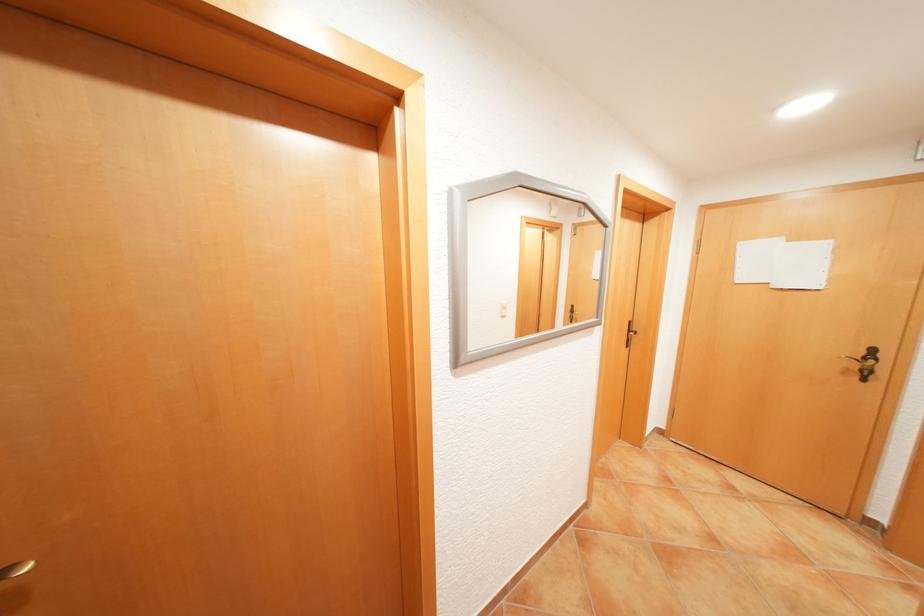
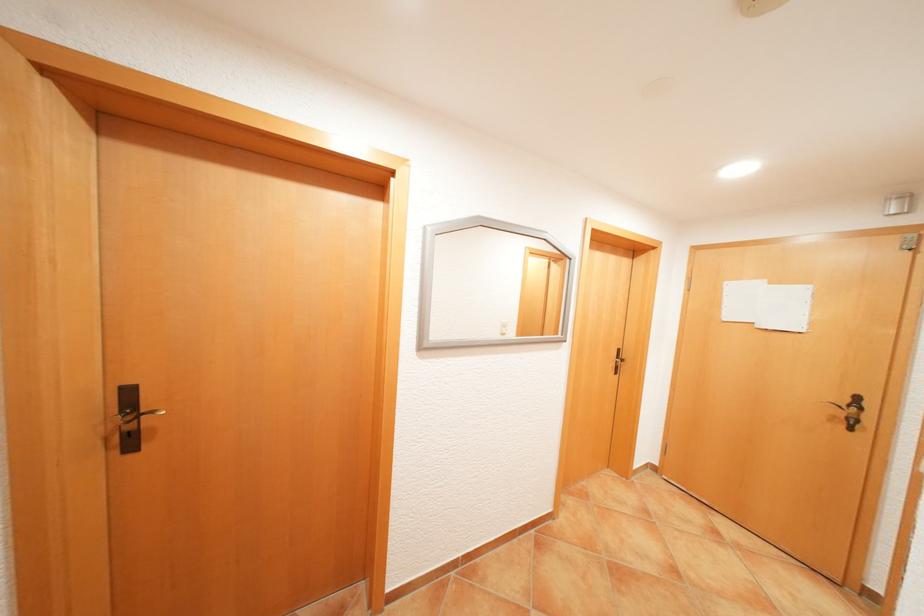
What movement of the cameraman would produce the second image?

The cameraman moved toward right, backward.